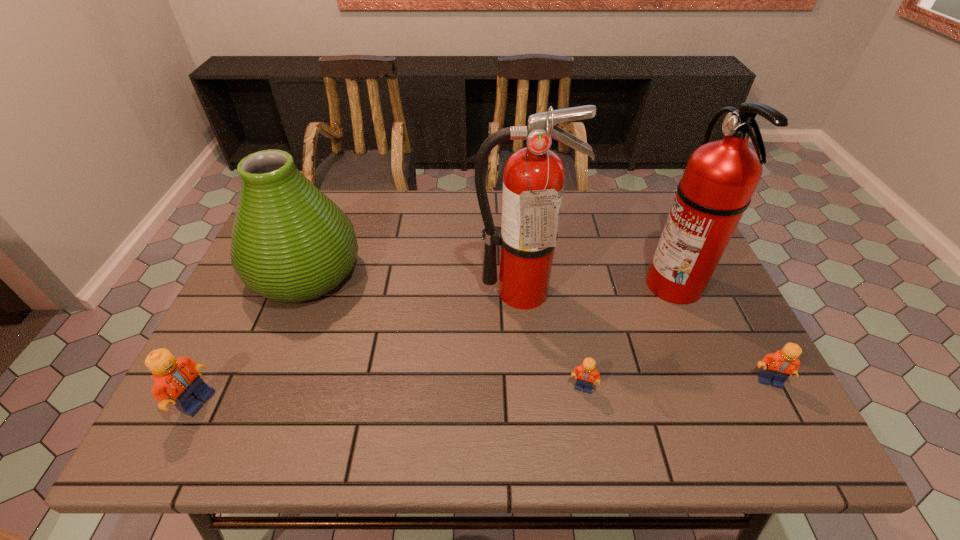
The width and height of the screenshot is (960, 540). I want to click on free space that satisfies the following two spatial constraints: 1. on the front-facing side of the shortest object; 2. on the front-facing side of the tallest Lego, so click(586, 402).

The image size is (960, 540). What are the coordinates of `free spot that satisfies the following two spatial constraints: 1. on the nozzle side of the left fire extinguisher; 2. on the front-facing side of the third shortest object` in the screenshot? It's located at (531, 402).